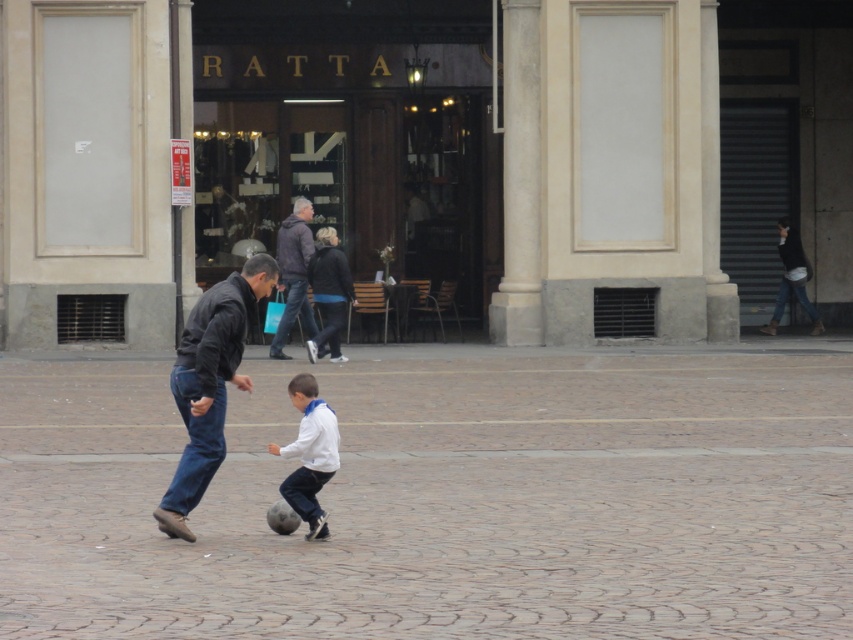
Question: Estimate the real-world distances between objects in this image. Which object is farther from the dark brown leather jacket at center?

Choices:
 (A) white matte shirt at center
 (B) dark blue jeans at center

Answer: (A)

Question: Which object appears farthest from the camera in this image?

Choices:
 (A) dark brown leather jacket at center
 (B) dark blue jeans at center

Answer: (A)

Question: Which of the following is the closest to the observer?

Choices:
 (A) dark blue jeans at center
 (B) white matte shirt at center

Answer: (B)

Question: Is dark blue jeans at center thinner than dark brown leather jacket at center?

Choices:
 (A) yes
 (B) no

Answer: (A)

Question: Is white matte shirt at center above dark brown leather jacket at center?

Choices:
 (A) no
 (B) yes

Answer: (A)

Question: Considering the relative positions of dark blue jeans at center and dark brown leather jacket at center in the image provided, where is dark blue jeans at center located with respect to dark brown leather jacket at center?

Choices:
 (A) below
 (B) above

Answer: (A)